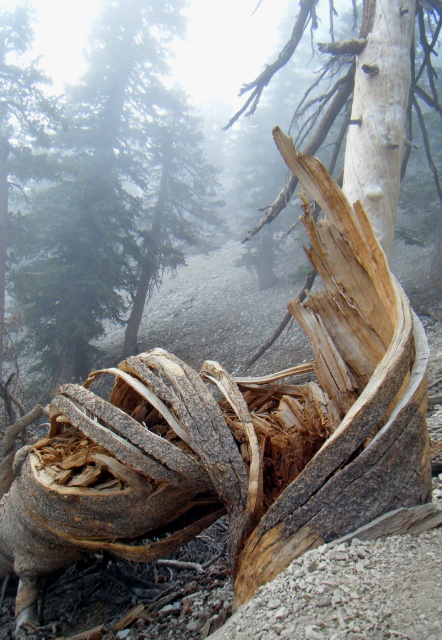
You are a hiker trying to cross a narrow forest path. You notice two tree features ahead of you. The rough bark tree trunk at center is blocking your path, and the white textured bark at upper right is above it. Given their widths, which tree feature do you think you can step around more easily?

The rough bark tree trunk at center is wider than the white textured bark at upper right. Since the rough bark tree trunk at center is wider, you can step around the white textured bark at upper right more easily.

You are an environmental scientist examining the forest scene. You need to determine which of the two tree parts, the rough bark tree trunk at center or the white textured bark at upper right, requires more immediate attention for preservation efforts based on their sizes. Which one should you prioritize?

The rough bark tree trunk at center is larger in size than the white textured bark at upper right, so it should be prioritized for preservation efforts due to its greater size.

In the scene shown: You are an explorer in the misty forest. You see the rough bark tree trunk at center and the white textured bark at upper right. Which one is positioned more to the left side of the image?

The rough bark tree trunk at center is positioned more to the left side of the image than the white textured bark at upper right.